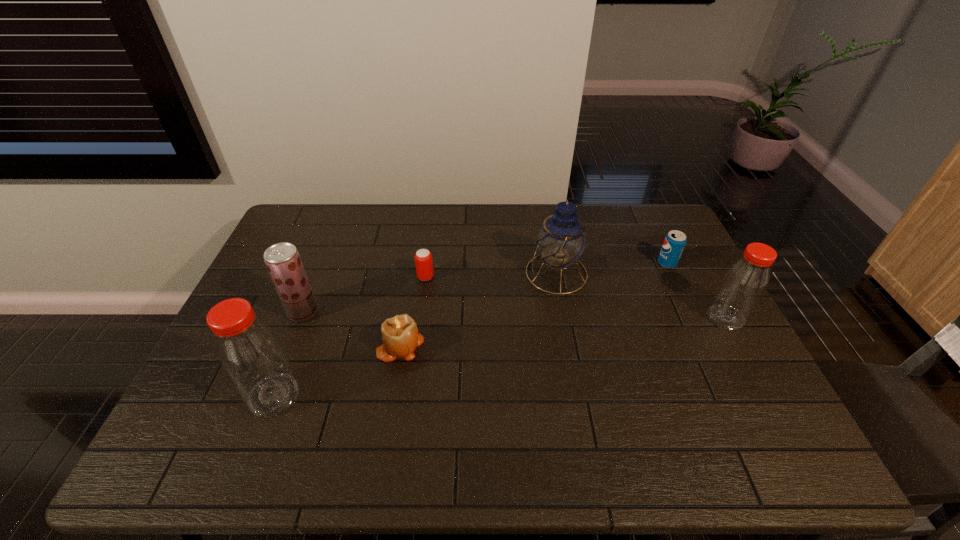
Identify the location of fruit juice located in the left edge section of the desktop. The width and height of the screenshot is (960, 540). (284, 264).

Image resolution: width=960 pixels, height=540 pixels. Identify the location of bottle located at the right edge. (743, 285).

Where is `soda can situated at the right edge`? soda can situated at the right edge is located at coordinates (674, 243).

Identify the location of object that is at the near left corner. pyautogui.click(x=248, y=350).

In the image, there is a desktop. Where is `free region at the far edge`? This screenshot has height=540, width=960. free region at the far edge is located at coordinates (431, 211).

Locate an element on the screen. free spot at the near edge of the desktop is located at coordinates (528, 421).

Where is `free point at the right edge`? free point at the right edge is located at coordinates (689, 252).

The width and height of the screenshot is (960, 540). What are the coordinates of `vacant position at the far left corner of the desktop` in the screenshot? It's located at (292, 214).

Locate an element on the screen. The height and width of the screenshot is (540, 960). unoccupied area between the farther bottle and the beer can is located at coordinates (576, 298).

At what (x,y) coordinates should I click in order to perform the action: click on unoccupied area between the fruit juice and the shortest object. Please return your answer as a coordinate pair (x, y). Image resolution: width=960 pixels, height=540 pixels. Looking at the image, I should click on (364, 294).